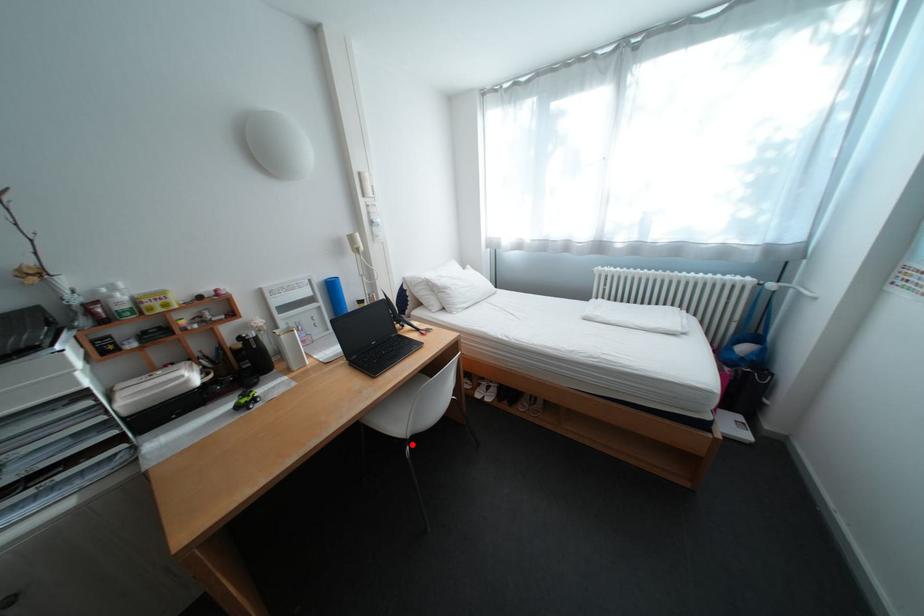
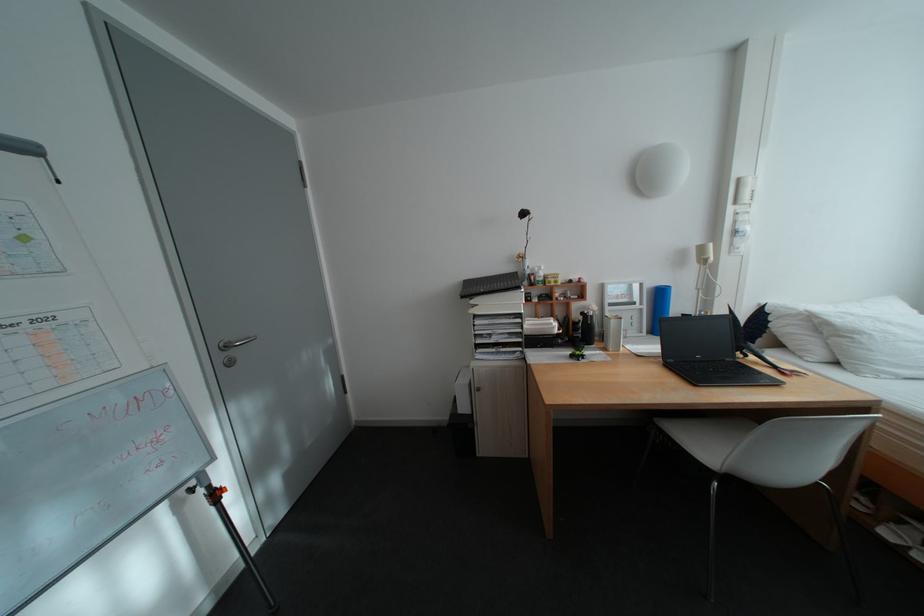
Find the pixel in the second image that matches the highlighted location in the first image.

(718, 472)